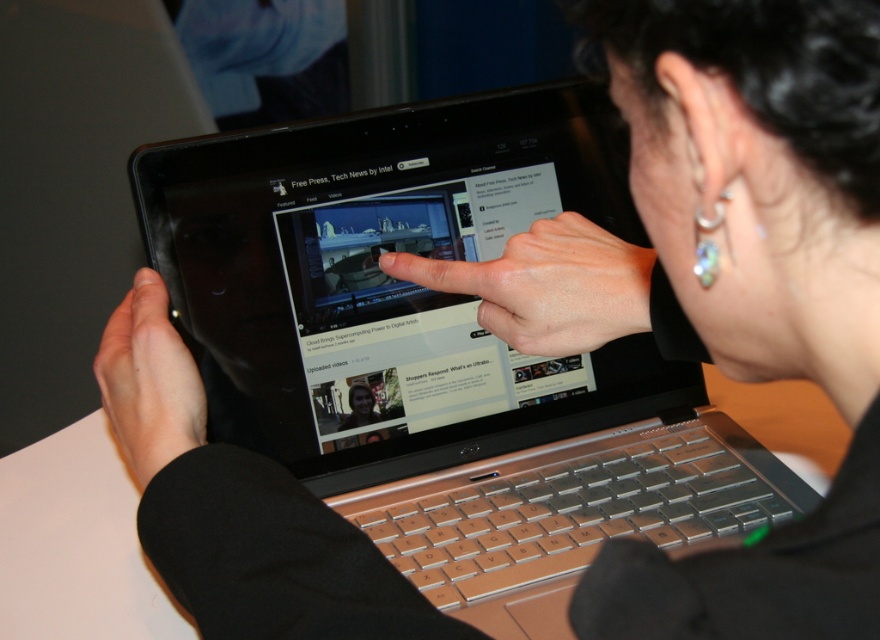
Who is positioned more to the left, matte black screen at center or matte black finger at center?

matte black screen at center

Is point (424, 301) positioned before point (617, 330)?

No.

Does point (464, 202) come closer to viewer compared to point (583, 337)?

No, it is behind (583, 337).

You are a GUI agent. You are given a task and a screenshot of the screen. Output one action in this format:
    pyautogui.click(x=<x>, y=<y>)
    Task: Click on the matte black screen at center
    The height and width of the screenshot is (640, 880).
    Given the screenshot: What is the action you would take?
    pyautogui.click(x=411, y=308)

From the picture: Is silver metallic laptop at center taller than matte black tablet at upper center?

Yes, silver metallic laptop at center is taller than matte black tablet at upper center.

Does point (433, 387) come in front of point (126, 308)?

No, it is behind (126, 308).

The height and width of the screenshot is (640, 880). In order to click on silver metallic laptop at center in this screenshot , I will do `click(391, 282)`.

Does silver metallic laptop at center have a smaller size compared to matte black finger at center?

No.

Is silver metallic laptop at center positioned behind matte black finger at center?

No, it is not.

What do you see at coordinates (391, 282) in the screenshot?
I see `silver metallic laptop at center` at bounding box center [391, 282].

The image size is (880, 640). In order to click on silver metallic laptop at center in this screenshot , I will do `click(391, 282)`.